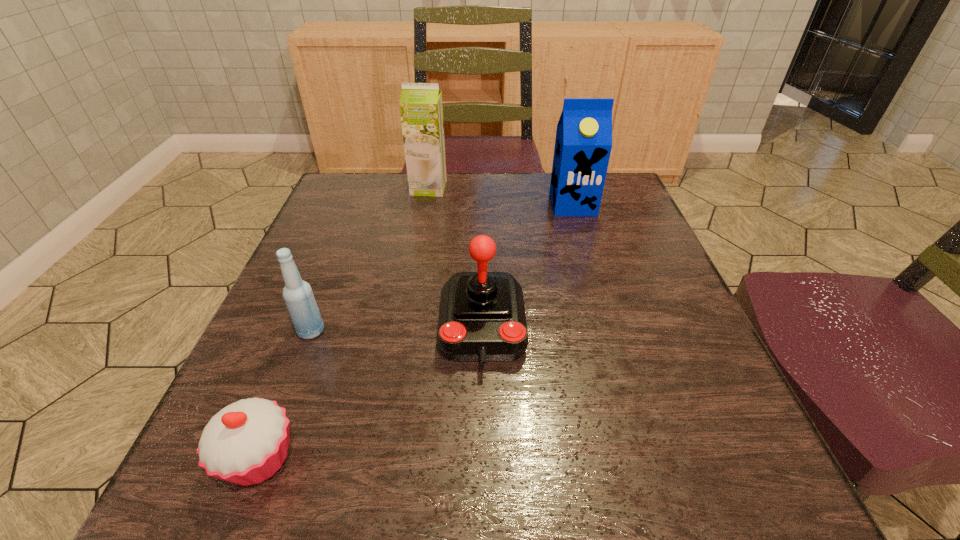
At what (x,y) coordinates should I click in order to perform the action: click on the third object from left to right. Please return your answer as a coordinate pair (x, y). Looking at the image, I should click on [x=421, y=109].

I want to click on the rightmost object, so pyautogui.click(x=583, y=143).

Image resolution: width=960 pixels, height=540 pixels. Identify the location of joystick. (482, 317).

Locate an element on the screen. This screenshot has width=960, height=540. bottle is located at coordinates (298, 296).

Identify the location of the shortest object. (246, 442).

Where is `the nearest object`? Image resolution: width=960 pixels, height=540 pixels. the nearest object is located at coordinates point(246,442).

Identify the location of vacant space located on the front of the third object from left to right. The width and height of the screenshot is (960, 540). (409, 303).

At what (x,y) coordinates should I click in order to perform the action: click on free location located with the cap open on the rightmost object. Please return your answer as a coordinate pair (x, y). This screenshot has width=960, height=540. Looking at the image, I should click on (601, 300).

Identify the location of vacant space located 0.150m on the base of the joystick. The image size is (960, 540). (483, 467).

Find the location of a particular element. The height and width of the screenshot is (540, 960). free space located 0.270m on the front of the bottle is located at coordinates (245, 503).